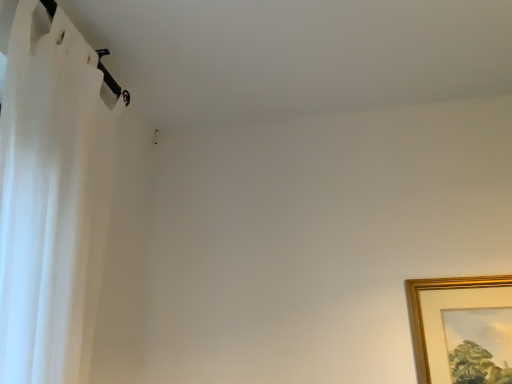
Describe the element at coordinates (51, 193) in the screenshot. The width and height of the screenshot is (512, 384). I see `white sheer curtain at left` at that location.

This screenshot has height=384, width=512. In order to click on white sheer curtain at left in this screenshot , I will do `click(51, 193)`.

What are the coordinates of `white sheer curtain at left` in the screenshot? It's located at (51, 193).